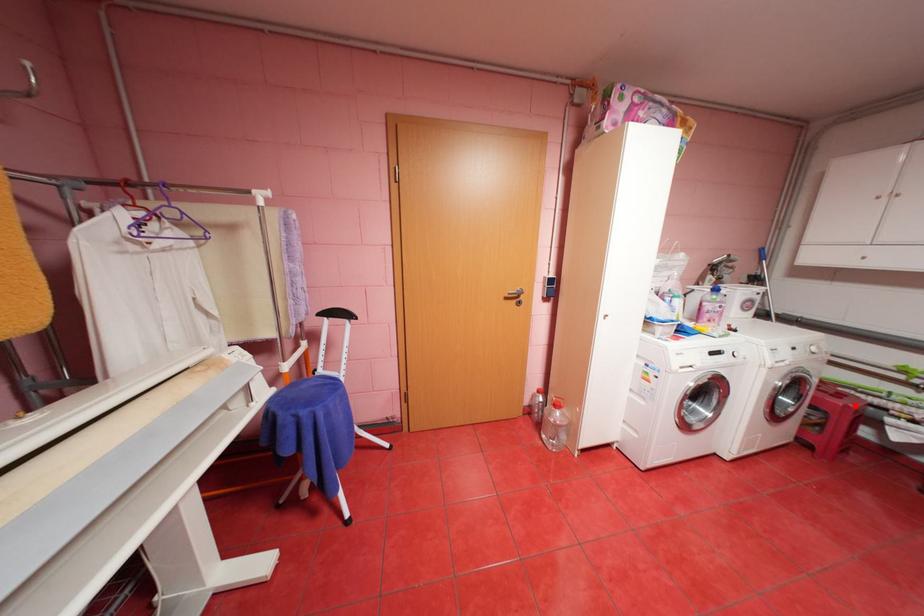
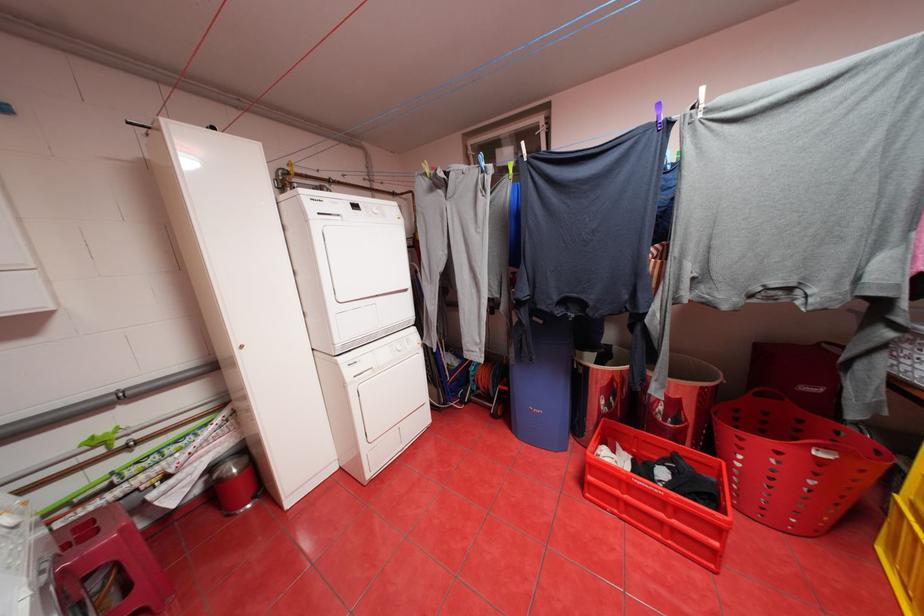
Question: I am providing you with two images of the same scene from different viewpoints. Image1 has a red point marked. In image2, the corresponding 3D location appears at what relative position? Reply with the corresponding letter.

Choices:
 (A) Closer
 (B) Farther

Answer: (B)